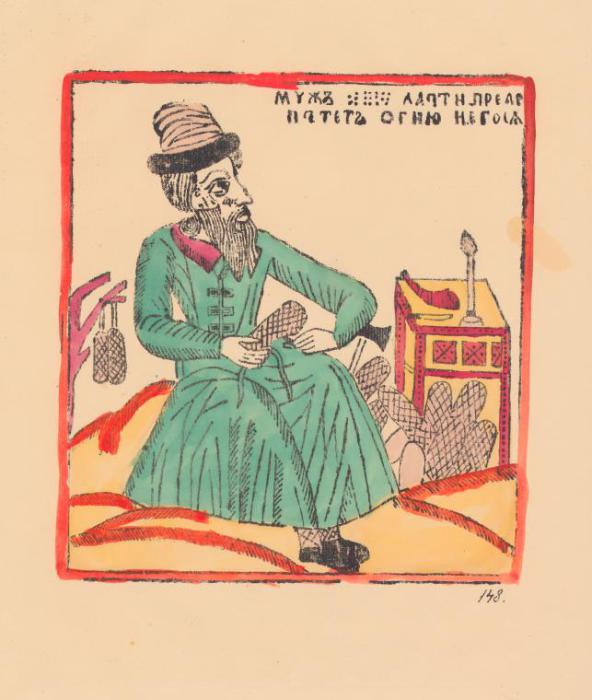
At what (x,y) coordinates should I click in order to perform the action: click on desk. Please return your answer as a coordinate pair (x, y). This screenshot has height=700, width=592. Looking at the image, I should click on (444, 323).